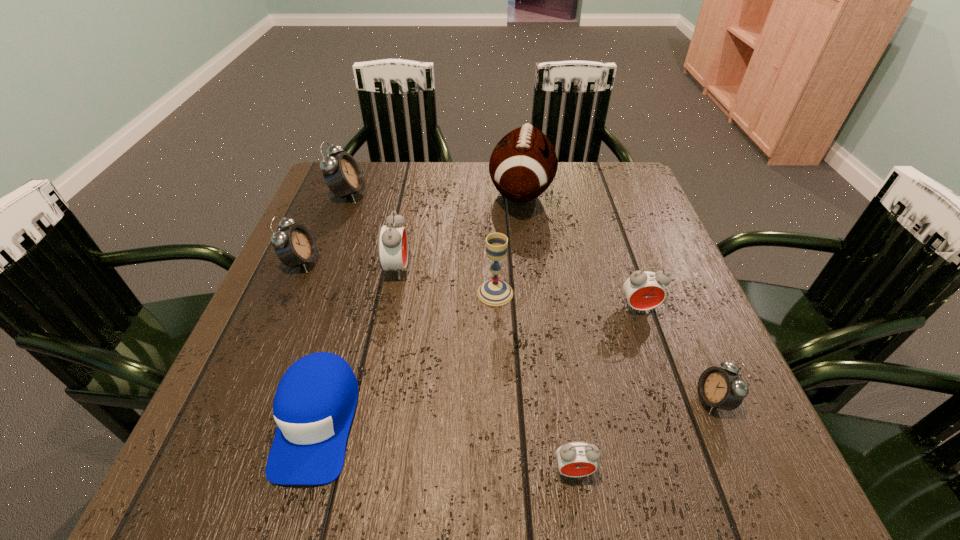
Where is `vacant area that lies between the football (American) and the baseball cap`? vacant area that lies between the football (American) and the baseball cap is located at coordinates (420, 307).

You are a GUI agent. You are given a task and a screenshot of the screen. Output one action in this format:
    pyautogui.click(x=<x>, y=<y>)
    Task: Click on the vacant region between the gray chalice and the rightmost white alarm clock
    The width and height of the screenshot is (960, 540).
    Given the screenshot: What is the action you would take?
    pyautogui.click(x=604, y=346)

Locate an element on the screen. This screenshot has height=540, width=960. free space between the baseball cap and the second object from right to left is located at coordinates (478, 364).

Find the location of a particular element. The height and width of the screenshot is (540, 960). vacant area that lies between the smallest red alarm clock and the rightmost alarm clock is located at coordinates (643, 435).

The width and height of the screenshot is (960, 540). Identify the location of vacant space in between the farthest alarm clock and the tallest object. (435, 194).

You are a GUI agent. You are given a task and a screenshot of the screen. Output one action in this format:
    pyautogui.click(x=<x>, y=<y>)
    Task: Click on the vacant space that is in between the rightmost alarm clock and the tallest object
    The width and height of the screenshot is (960, 540).
    Given the screenshot: What is the action you would take?
    pyautogui.click(x=617, y=296)

At what (x,y) coordinates should I click in order to perform the action: click on vacant space that's between the rightmost object and the second nearest white alarm clock. Please return your answer as a coordinate pair (x, y). Looking at the image, I should click on (507, 331).

Identify which object is the nearest to the farthest alarm clock. Please provide its 2D coordinates. Your answer should be formatted as a tuple, i.e. [(x, y)], where the tuple contains the x and y coordinates of a point satisfying the conditions above.

[(295, 245)]

Select which object is the eighth closest to the second red alarm clock from left to right. Please provide its 2D coordinates. Your answer should be formatted as a tuple, i.e. [(x, y)], where the tuple contains the x and y coordinates of a point satisfying the conditions above.

[(342, 174)]

You are a GUI agent. You are given a task and a screenshot of the screen. Output one action in this format:
    pyautogui.click(x=<x>, y=<y>)
    Task: Click on the alarm clock that is the fourth closest to the nearest alarm clock
    The height and width of the screenshot is (540, 960).
    Given the screenshot: What is the action you would take?
    pyautogui.click(x=295, y=245)